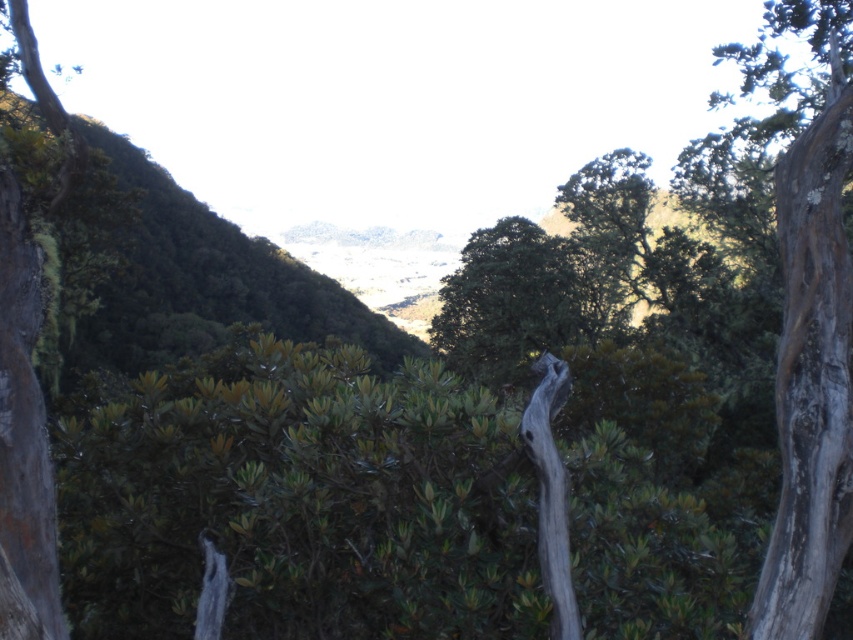
Question: Which of the following is the farthest from the observer?

Choices:
 (A) (838, 45)
 (B) (492, 266)

Answer: (B)

Question: Is gray textured bark at right above green leafy tree at center?

Choices:
 (A) yes
 (B) no

Answer: (A)

Question: Is gray textured bark at right to the right of green leafy tree at center from the viewer's perspective?

Choices:
 (A) no
 (B) yes

Answer: (B)

Question: Does gray textured bark at right have a greater width compared to green leafy tree at center?

Choices:
 (A) no
 (B) yes

Answer: (B)

Question: Which point is farther from the camera taking this photo?

Choices:
 (A) [811, 561]
 (B) [554, 252]

Answer: (B)